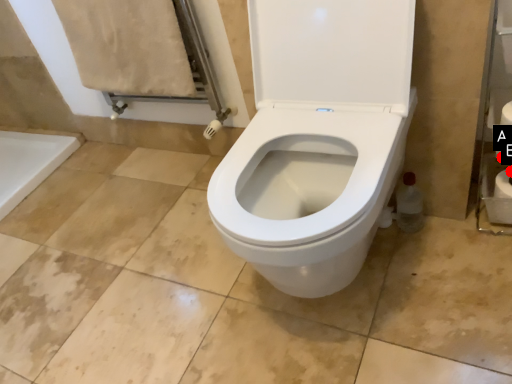
Question: Two points are circled on the image, labeled by A and B beside each circle. Which point is closer to the camera?

Choices:
 (A) A is closer
 (B) B is closer

Answer: (A)